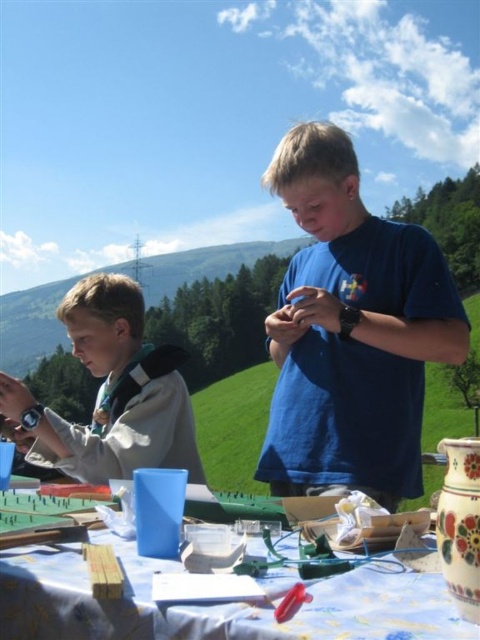
You are trying to decide whether to place a new book on the table between the wooden blocks at lower left and the white fleece jacket at left. Considering their heights, which object should you place the book next to to ensure it doesn

The wooden blocks at lower left is not as tall as the white fleece jacket at left, so placing the book next to the white fleece jacket at left would provide a taller support if needed, but since the question is about height comparison for placement, the book can be placed next to either as height doesn

You are a photographer standing at the edge of the hillside in the background. You need to capture a photo that includes both the blue matte shirt at center and the wooden blocks at lower left. Based on their heights, which object should you focus on first to ensure both are in the frame?

The blue matte shirt at center is taller than the wooden blocks at lower left, so you should focus on the blue matte shirt at center first to ensure both objects are in the frame.